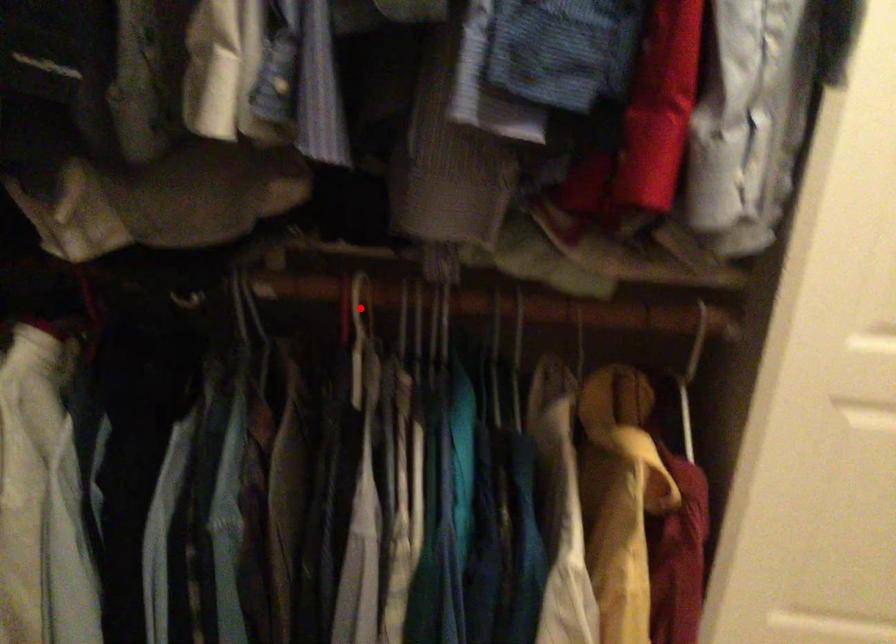
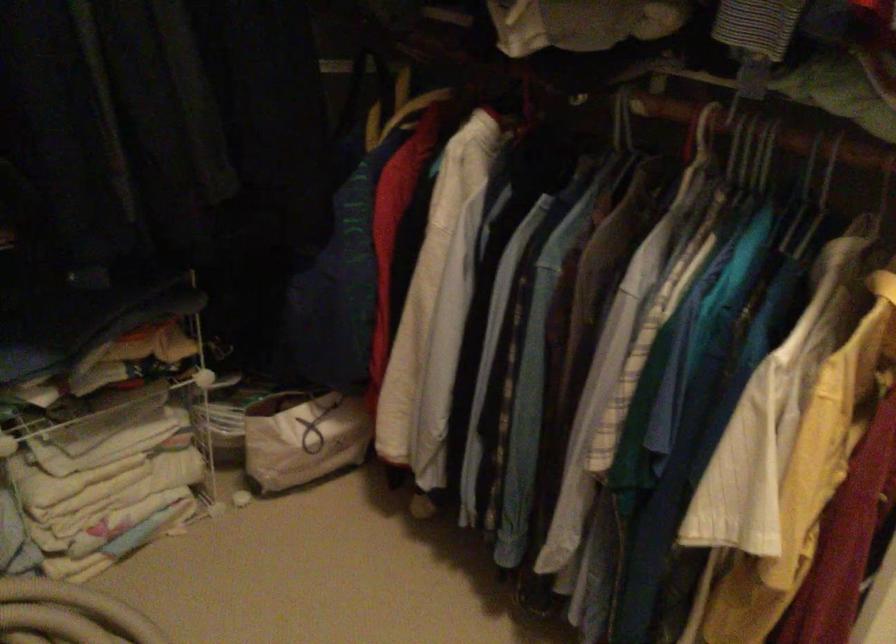
Question: I am providing you with two images of the same scene from different viewpoints. A red point is shown in image1. For the corresponding object point in image2, is it positioned nearer or farther from the camera?

Choices:
 (A) Nearer
 (B) Farther

Answer: (B)